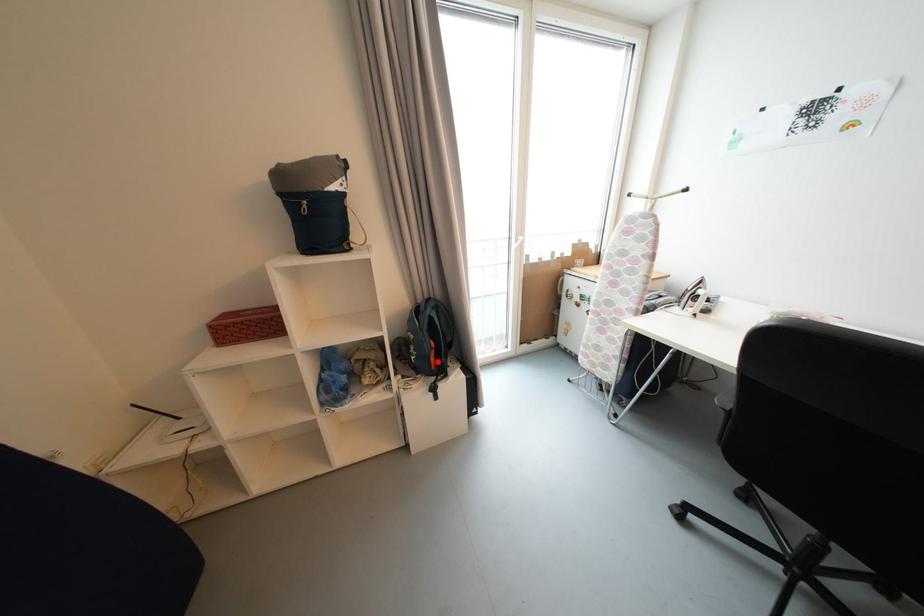
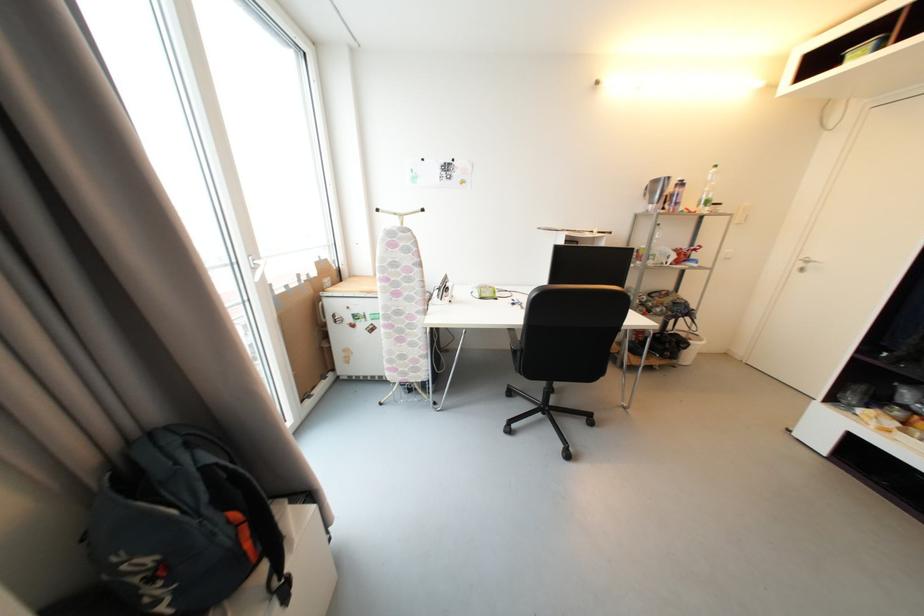
Where in the second image is the point corresponding to the highlighted location from the first image?

(253, 546)